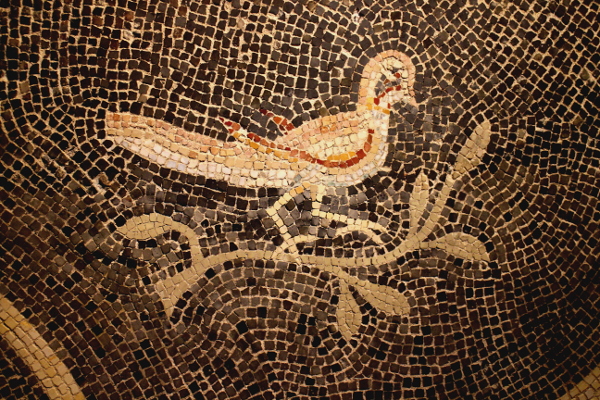
You are a GUI agent. You are given a task and a screenshot of the screen. Output one action in this format:
    pyautogui.click(x=<x>, y=<y>)
    Task: Click on the tiles
    This screenshot has height=400, width=600.
    Given the screenshot: What is the action you would take?
    pyautogui.click(x=479, y=318)